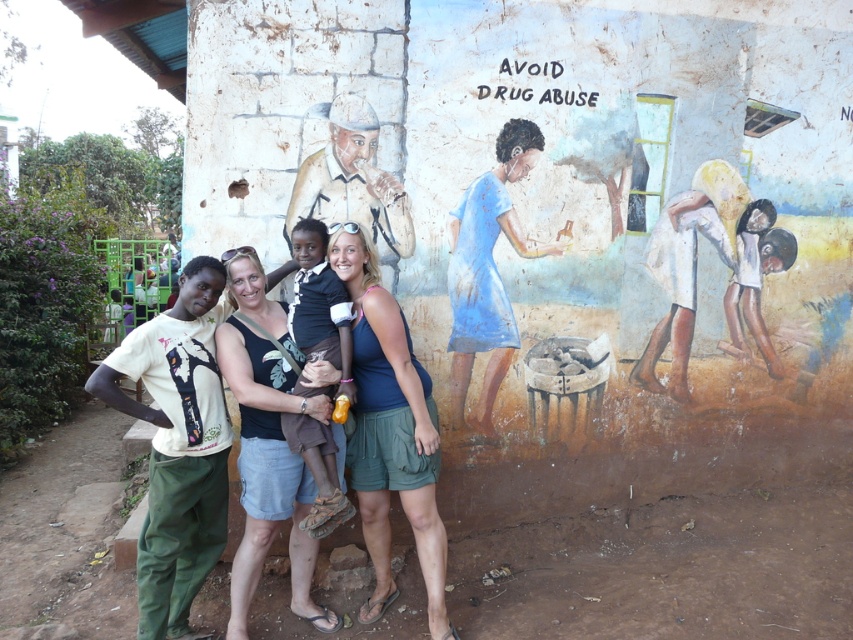
Question: Considering the real-world distances, which object is closest to the matte white dress at lower right?

Choices:
 (A) blue matte dress at center
 (B) blue fabric tank top at center

Answer: (A)

Question: Among these points, which one is nearest to the camera?

Choices:
 (A) (647, 266)
 (B) (274, 310)
 (C) (454, 397)
 (D) (408, 513)

Answer: (D)

Question: Can you confirm if matte white dress at lower right is wider than blue matte dress at center?

Choices:
 (A) yes
 (B) no

Answer: (A)

Question: Which object is the farthest from the blue matte dress at center?

Choices:
 (A) matte black tank top at center
 (B) blue fabric tank top at center
 (C) matte white dress at lower right

Answer: (A)

Question: Observing the image, what is the correct spatial positioning of matte black tank top at center in reference to blue matte dress at center?

Choices:
 (A) below
 (B) above

Answer: (A)

Question: Can you confirm if matte black tank top at center is smaller than blue matte dress at center?

Choices:
 (A) no
 (B) yes

Answer: (A)